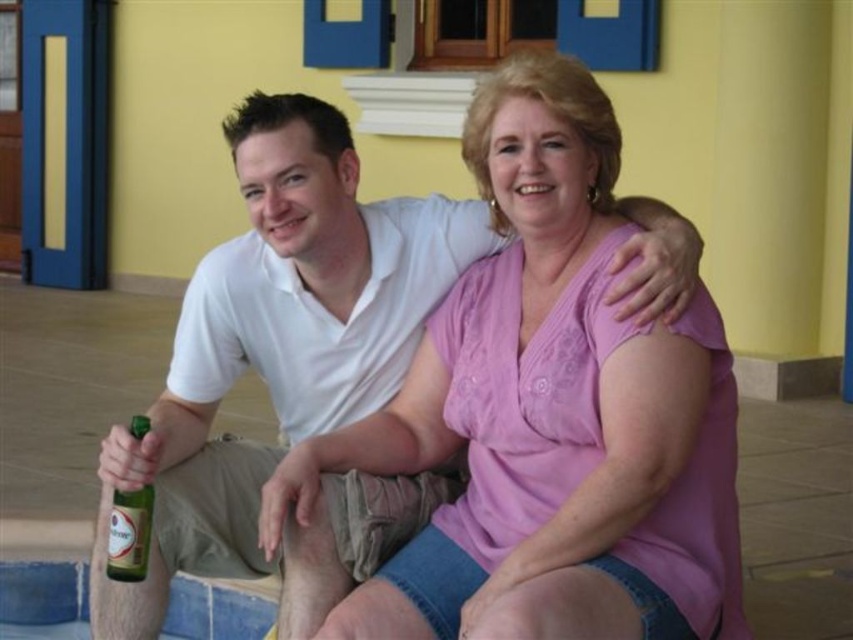
Question: Is pink cotton shirt at center positioned before green glass bottle at lower left?

Choices:
 (A) yes
 (B) no

Answer: (A)

Question: Does pink cotton shirt at center appear on the right side of green glass bottle at lower left?

Choices:
 (A) no
 (B) yes

Answer: (B)

Question: Can you confirm if pink cotton shirt at center is wider than green glass bottle at lower left?

Choices:
 (A) yes
 (B) no

Answer: (A)

Question: Which object appears closest to the camera in this image?

Choices:
 (A) pink cotton shirt at center
 (B) green glass bottle at lower left

Answer: (A)